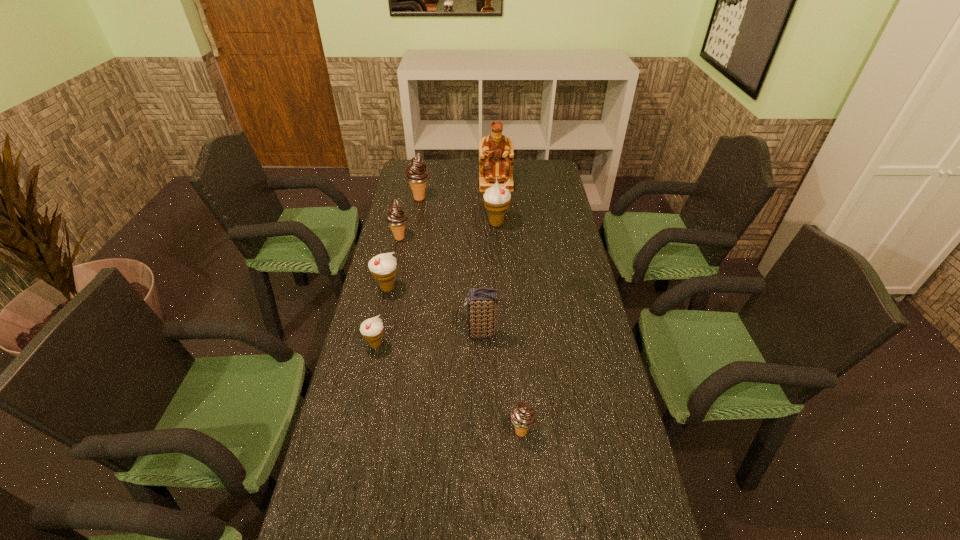
I want to click on the tallest object, so click(x=496, y=156).

Locate an element on the screen. This screenshot has height=540, width=960. the farthest white icecream is located at coordinates (496, 198).

The height and width of the screenshot is (540, 960). I want to click on the rightmost white icecream, so click(496, 198).

At what (x,y) coordinates should I click in order to perform the action: click on the farthest icecream. Please return your answer as a coordinate pair (x, y). Looking at the image, I should click on (417, 174).

Locate an element on the screen. the farthest chocolate icecream is located at coordinates (417, 174).

This screenshot has height=540, width=960. Find the location of `clutch bag`. clutch bag is located at coordinates (482, 302).

Image resolution: width=960 pixels, height=540 pixels. What are the coordinates of `the second biggest chocolate icecream` in the screenshot? It's located at (396, 218).

I want to click on the third nearest icecream, so click(x=383, y=267).

At what (x,y) coordinates should I click in order to perform the action: click on the second smallest white icecream. Please return your answer as a coordinate pair (x, y). Looking at the image, I should click on (383, 267).

Image resolution: width=960 pixels, height=540 pixels. Find the location of `the nearest white icecream`. the nearest white icecream is located at coordinates (372, 329).